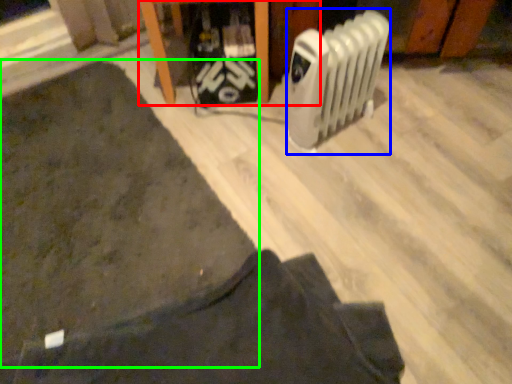
Question: Considering the real-world distances, which object is farthest from furniture (highlighted by a red box)? radiator (highlighted by a blue box) or mat (highlighted by a green box)?

Choices:
 (A) radiator
 (B) mat

Answer: (B)